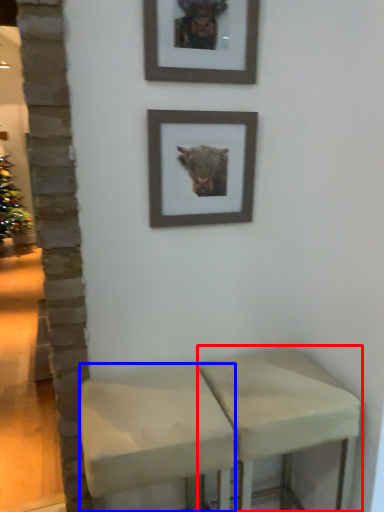
Question: Which of the following is the closest to the observer, stool (highlighted by a red box) or stool (highlighted by a blue box)?

Choices:
 (A) stool
 (B) stool

Answer: (B)